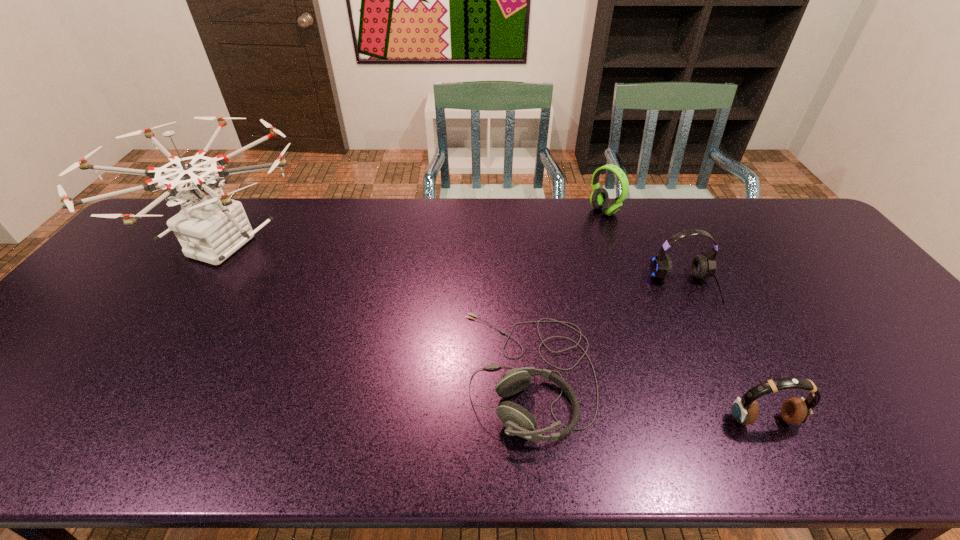
Identify the location of free space located 0.070m on the outer surface of the leftmost headset. This screenshot has height=540, width=960. (433, 374).

Find the location of `blank space located 0.210m on the outer surface of the leftmost headset`. blank space located 0.210m on the outer surface of the leftmost headset is located at coordinates click(x=373, y=374).

The image size is (960, 540). Identify the location of vacant space located 0.290m on the outer surface of the leftmost headset. click(340, 374).

Identify the location of drone located in the far edge section of the desktop. (213, 227).

Find the location of a particular element. The height and width of the screenshot is (540, 960). headset that is positioned at the far edge is located at coordinates (599, 198).

Identify the location of object positioned at the left edge. (213, 227).

At what (x,y) coordinates should I click in order to perform the action: click on object positioned at the far left corner. Please return your answer as a coordinate pair (x, y). The image size is (960, 540). Looking at the image, I should click on pos(213,227).

You are a GUI agent. You are given a task and a screenshot of the screen. Output one action in this format:
    pyautogui.click(x=<x>, y=<y>)
    Task: Click on the vacant point at the far edge
    This screenshot has height=540, width=960.
    Given the screenshot: What is the action you would take?
    pyautogui.click(x=458, y=225)

At what (x,y) coordinates should I click in order to perform the action: click on blank space at the near edge. Please return your answer as a coordinate pair (x, y). Looking at the image, I should click on (373, 427).

Locate an element on the screen. The height and width of the screenshot is (540, 960). vacant region at the right edge of the desktop is located at coordinates (822, 253).